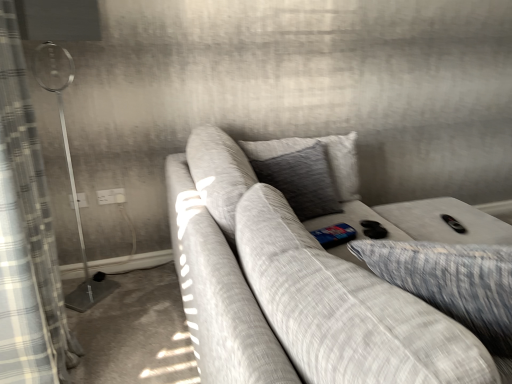
The height and width of the screenshot is (384, 512). Describe the element at coordinates (302, 181) in the screenshot. I see `gray textured pillow at center, which is the second pillow in right-to-left order` at that location.

The image size is (512, 384). What do you see at coordinates (82, 200) in the screenshot?
I see `white plastic electric outlet at lower left, the 2th electric outlet when ordered from right to left` at bounding box center [82, 200].

In order to click on white plastic electric outlet at upper left, marked as the 2th electric outlet in a left-to-right arrangement in this screenshot , I will do `click(111, 196)`.

From the image's perspective, which one is positioned higher, textured gray couch at center or gray textured pillow at center, arranged as the 1th pillow when viewed from the left?

gray textured pillow at center, arranged as the 1th pillow when viewed from the left.

Between textured gray couch at center and gray textured pillow at center, which is the second pillow in right-to-left order, which one has less height?

Standing shorter between the two is gray textured pillow at center, which is the second pillow in right-to-left order.

From the picture: How many degrees apart are the facing directions of textured gray couch at center and gray textured pillow at center, arranged as the 1th pillow when viewed from the left?

The angle between the facing direction of textured gray couch at center and the facing direction of gray textured pillow at center, arranged as the 1th pillow when viewed from the left, is 89 degrees.

Which is farther from the camera, (482, 351) or (337, 199)?

Point (337, 199)

Who is smaller, textured gray pillow at right, arranged as the 1th pillow when viewed from the right, or plaid fabric curtain at left?

textured gray pillow at right, arranged as the 1th pillow when viewed from the right, is smaller.

Is textured gray pillow at right, arranged as the 1th pillow when viewed from the right, next to plaid fabric curtain at left and touching it?

No, textured gray pillow at right, arranged as the 1th pillow when viewed from the right, is not in contact with plaid fabric curtain at left.

You are a GUI agent. You are given a task and a screenshot of the screen. Output one action in this format:
    pyautogui.click(x=<x>, y=<y>)
    Task: Click on the curtain in front of the textured gray pillow at right, the 2th pillow positioned from the left
    Image resolution: width=512 pixels, height=384 pixels.
    Given the screenshot: What is the action you would take?
    pyautogui.click(x=32, y=194)

Is white plastic electric outlet at upper left, placed as the 1th electric outlet when sorted from right to left, completely or partially outside of textured gray pillow at right, the 2th pillow positioned from the left?

Yes, white plastic electric outlet at upper left, placed as the 1th electric outlet when sorted from right to left, is located beyond the bounds of textured gray pillow at right, the 2th pillow positioned from the left.

Would you consider white plastic electric outlet at upper left, marked as the 2th electric outlet in a left-to-right arrangement, to be distant from textured gray pillow at right, arranged as the 1th pillow when viewed from the right?

white plastic electric outlet at upper left, marked as the 2th electric outlet in a left-to-right arrangement, is positioned a significant distance from textured gray pillow at right, arranged as the 1th pillow when viewed from the right.

Which object is thinner, white plastic electric outlet at upper left, marked as the 2th electric outlet in a left-to-right arrangement, or textured gray pillow at right, arranged as the 1th pillow when viewed from the right?

Thinner between the two is white plastic electric outlet at upper left, marked as the 2th electric outlet in a left-to-right arrangement.

From the picture: Considering the positions of objects white plastic electric outlet at upper left, marked as the 2th electric outlet in a left-to-right arrangement, and textured gray pillow at right, arranged as the 1th pillow when viewed from the right, in the image provided, who is behind, white plastic electric outlet at upper left, marked as the 2th electric outlet in a left-to-right arrangement, or textured gray pillow at right, arranged as the 1th pillow when viewed from the right,?

white plastic electric outlet at upper left, marked as the 2th electric outlet in a left-to-right arrangement, is behind.

Is textured gray pillow at right, arranged as the 1th pillow when viewed from the right, wider than textured gray couch at center?

No, textured gray pillow at right, arranged as the 1th pillow when viewed from the right, is not wider than textured gray couch at center.

Is textured gray pillow at right, arranged as the 1th pillow when viewed from the right, looking in the opposite direction of textured gray couch at center?

Yes.

The height and width of the screenshot is (384, 512). I want to click on pillow below the textured gray couch at center (from a real-world perspective), so click(x=451, y=282).

From the image's perspective, is plaid fabric curtain at left under white plastic electric outlet at upper left, marked as the 2th electric outlet in a left-to-right arrangement?

Correct, plaid fabric curtain at left appears lower than white plastic electric outlet at upper left, marked as the 2th electric outlet in a left-to-right arrangement, in the image.

Which object is positioned more to the left, plaid fabric curtain at left or white plastic electric outlet at upper left, placed as the 1th electric outlet when sorted from right to left?

From the viewer's perspective, plaid fabric curtain at left appears more on the left side.

Considering the points (62, 349) and (119, 201), which point is behind, point (62, 349) or point (119, 201)?

The point (119, 201) is farther.

Is plaid fabric curtain at left outside of white plastic electric outlet at upper left, placed as the 1th electric outlet when sorted from right to left?

plaid fabric curtain at left is positioned outside white plastic electric outlet at upper left, placed as the 1th electric outlet when sorted from right to left.

Who is smaller, plaid fabric curtain at left or textured gray couch at center?

plaid fabric curtain at left.

Is plaid fabric curtain at left to the right of textured gray couch at center from the viewer's perspective?

Incorrect, plaid fabric curtain at left is not on the right side of textured gray couch at center.

Which is in front, point (5, 148) or point (413, 373)?

The point (413, 373) is closer.

You are a GUI agent. You are given a task and a screenshot of the screen. Output one action in this format:
    pyautogui.click(x=<x>, y=<y>)
    Task: Click on the curtain below the white plastic electric outlet at lower left, the 2th electric outlet when ordered from right to left (from the image's perspective)
    
    Given the screenshot: What is the action you would take?
    pyautogui.click(x=32, y=194)

Based on the photo, considering the relative positions of white plastic electric outlet at lower left, the 2th electric outlet when ordered from right to left, and plaid fabric curtain at left in the image provided, is white plastic electric outlet at lower left, the 2th electric outlet when ordered from right to left, to the left or to the right of plaid fabric curtain at left?

From the image, it's evident that white plastic electric outlet at lower left, the 2th electric outlet when ordered from right to left, is to the left of plaid fabric curtain at left.

Which of these two, white plastic electric outlet at lower left, the first electric outlet in the left-to-right sequence, or plaid fabric curtain at left, is bigger?

With larger size is plaid fabric curtain at left.

I want to click on studio couch in front of the gray textured pillow at center, which is the second pillow in right-to-left order, so click(310, 275).

Find the location of a particular element. curtain on the left of textured gray pillow at right, the 2th pillow positioned from the left is located at coordinates (32, 194).

From the image, which object appears to be nearer to white plastic electric outlet at upper left, placed as the 1th electric outlet when sorted from right to left, textured gray couch at center or plaid fabric curtain at left?

plaid fabric curtain at left lies closer to white plastic electric outlet at upper left, placed as the 1th electric outlet when sorted from right to left, than the other object.

Considering their positions, is gray textured pillow at center, arranged as the 1th pillow when viewed from the left, positioned closer to white plastic electric outlet at upper left, placed as the 1th electric outlet when sorted from right to left, than textured gray pillow at right, the 2th pillow positioned from the left?

The object closer to white plastic electric outlet at upper left, placed as the 1th electric outlet when sorted from right to left, is gray textured pillow at center, arranged as the 1th pillow when viewed from the left.

Considering their positions, is plaid fabric curtain at left positioned closer to gray textured pillow at center, arranged as the 1th pillow when viewed from the left, than textured gray couch at center?

textured gray couch at center is closer to gray textured pillow at center, arranged as the 1th pillow when viewed from the left.

Estimate the real-world distances between objects in this image. Which object is closer to white plastic electric outlet at upper left, marked as the 2th electric outlet in a left-to-right arrangement, white plastic electric outlet at lower left, the 2th electric outlet when ordered from right to left, or textured gray couch at center?

white plastic electric outlet at lower left, the 2th electric outlet when ordered from right to left, is positioned closer to the anchor white plastic electric outlet at upper left, marked as the 2th electric outlet in a left-to-right arrangement.

Consider the image. From the image, which object appears to be nearer to gray textured pillow at center, arranged as the 1th pillow when viewed from the left, textured gray pillow at right, arranged as the 1th pillow when viewed from the right, or white plastic electric outlet at upper left, marked as the 2th electric outlet in a left-to-right arrangement?

Based on the image, white plastic electric outlet at upper left, marked as the 2th electric outlet in a left-to-right arrangement, appears to be nearer to gray textured pillow at center, arranged as the 1th pillow when viewed from the left.

Considering their positions, is gray textured pillow at center, arranged as the 1th pillow when viewed from the left, positioned further to textured gray pillow at right, arranged as the 1th pillow when viewed from the right, than white plastic electric outlet at lower left, the first electric outlet in the left-to-right sequence?

white plastic electric outlet at lower left, the first electric outlet in the left-to-right sequence.

Looking at the image, which one is located closer to white plastic electric outlet at upper left, marked as the 2th electric outlet in a left-to-right arrangement, white plastic electric outlet at lower left, the first electric outlet in the left-to-right sequence, or textured gray pillow at right, arranged as the 1th pillow when viewed from the right?

white plastic electric outlet at lower left, the first electric outlet in the left-to-right sequence, lies closer to white plastic electric outlet at upper left, marked as the 2th electric outlet in a left-to-right arrangement, than the other object.

Considering their positions, is white plastic electric outlet at lower left, the first electric outlet in the left-to-right sequence, positioned closer to white plastic electric outlet at upper left, placed as the 1th electric outlet when sorted from right to left, than plaid fabric curtain at left?

The object closer to white plastic electric outlet at upper left, placed as the 1th electric outlet when sorted from right to left, is white plastic electric outlet at lower left, the first electric outlet in the left-to-right sequence.

Locate an element on the screen. The image size is (512, 384). electric outlet between white plastic electric outlet at lower left, the first electric outlet in the left-to-right sequence, and textured gray pillow at right, arranged as the 1th pillow when viewed from the right, in the horizontal direction is located at coordinates (111, 196).

At what (x,y) coordinates should I click in order to perform the action: click on studio couch between plaid fabric curtain at left and textured gray pillow at right, the 2th pillow positioned from the left, from left to right. Please return your answer as a coordinate pair (x, y). This screenshot has width=512, height=384. Looking at the image, I should click on (310, 275).

This screenshot has width=512, height=384. Identify the location of pillow between plaid fabric curtain at left and textured gray pillow at right, arranged as the 1th pillow when viewed from the right, from left to right. (302, 181).

In order to click on electric outlet between white plastic electric outlet at lower left, the first electric outlet in the left-to-right sequence, and gray textured pillow at center, arranged as the 1th pillow when viewed from the left in this screenshot , I will do `click(111, 196)`.